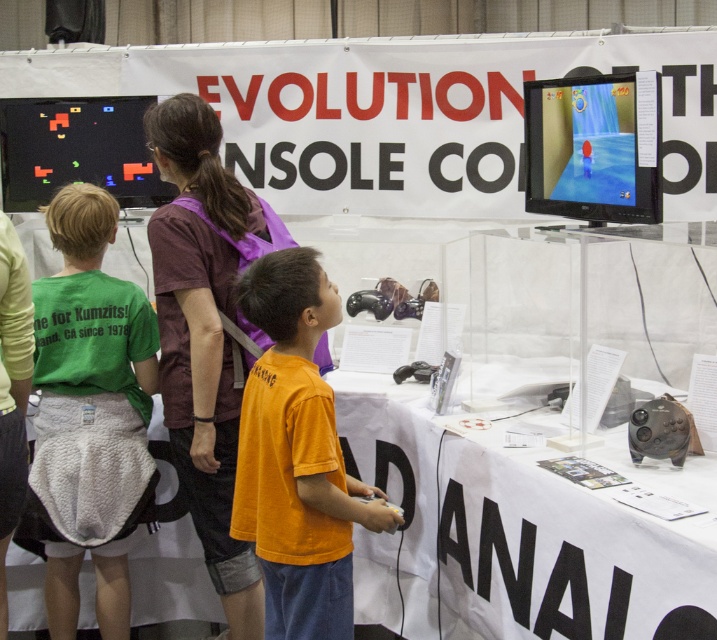
You are standing at point (212, 410) and want to move to point (607, 83). Which direction should you move?

Since point (212, 410) is behind point (607, 83), you should move forward to reach it.